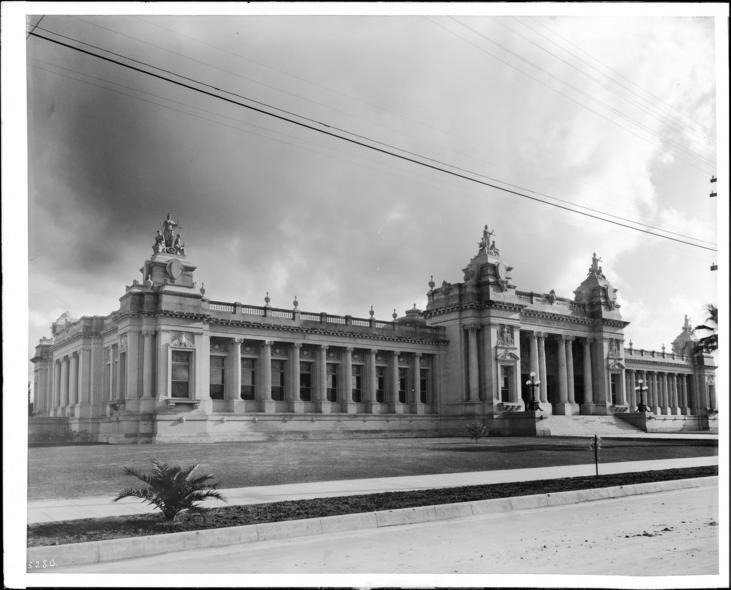
You are a GUI agent. You are given a task and a screenshot of the screen. Output one action in this format:
    pyautogui.click(x=<x>, y=<y>)
    Task: Click on the electrical wiring
    The width and height of the screenshot is (731, 590).
    Given the screenshot: What is the action you would take?
    pyautogui.click(x=181, y=110), pyautogui.click(x=181, y=101), pyautogui.click(x=202, y=88), pyautogui.click(x=218, y=85), pyautogui.click(x=281, y=90), pyautogui.click(x=289, y=76), pyautogui.click(x=499, y=54), pyautogui.click(x=509, y=52), pyautogui.click(x=639, y=229), pyautogui.click(x=664, y=147)